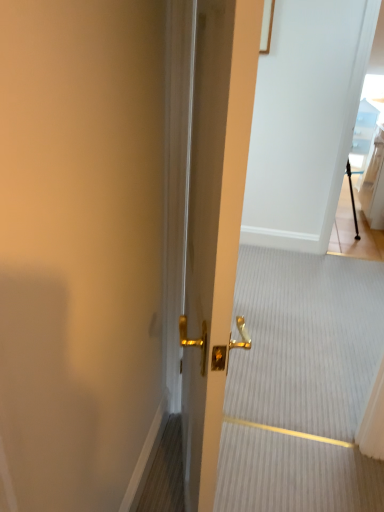
Question: From the image's perspective, is transparent glass door at upper right below metallic gold door handle at center?

Choices:
 (A) yes
 (B) no

Answer: (B)

Question: Does transparent glass door at upper right have a larger size compared to metallic gold door handle at center?

Choices:
 (A) yes
 (B) no

Answer: (A)

Question: Is transparent glass door at upper right to the right of metallic gold door handle at center from the viewer's perspective?

Choices:
 (A) yes
 (B) no

Answer: (A)

Question: From the image's perspective, is transparent glass door at upper right located above metallic gold door handle at center?

Choices:
 (A) no
 (B) yes

Answer: (B)

Question: Does transparent glass door at upper right have a smaller size compared to metallic gold door handle at center?

Choices:
 (A) no
 (B) yes

Answer: (A)

Question: Does point (377, 56) appear closer or farther from the camera than point (367, 301)?

Choices:
 (A) farther
 (B) closer

Answer: (A)

Question: From a real-world perspective, is transparent glass door at upper right physically located above or below metallic gold door handle at center?

Choices:
 (A) above
 (B) below

Answer: (A)

Question: In the image, is transparent glass door at upper right positioned in front of or behind metallic gold door handle at center?

Choices:
 (A) behind
 (B) front

Answer: (A)

Question: From their relative heights in the image, would you say transparent glass door at upper right is taller or shorter than metallic gold door handle at center?

Choices:
 (A) short
 (B) tall

Answer: (B)

Question: Looking at their shapes, would you say gold metallic door handle at center is wider or thinner than metallic gold door handle at center?

Choices:
 (A) wide
 (B) thin

Answer: (B)

Question: From the image's perspective, is gold metallic door handle at center above or below metallic gold door handle at center?

Choices:
 (A) above
 (B) below

Answer: (A)

Question: In the image, is gold metallic door handle at center on the left side or the right side of metallic gold door handle at center?

Choices:
 (A) left
 (B) right

Answer: (A)

Question: From a real-world perspective, is gold metallic door handle at center physically located above or below metallic gold door handle at center?

Choices:
 (A) below
 (B) above

Answer: (B)

Question: Relative to gold metallic door handle at center, is transparent glass door at upper right in front or behind?

Choices:
 (A) front
 (B) behind

Answer: (B)

Question: In terms of height, does transparent glass door at upper right look taller or shorter compared to gold metallic door handle at center?

Choices:
 (A) short
 (B) tall

Answer: (B)